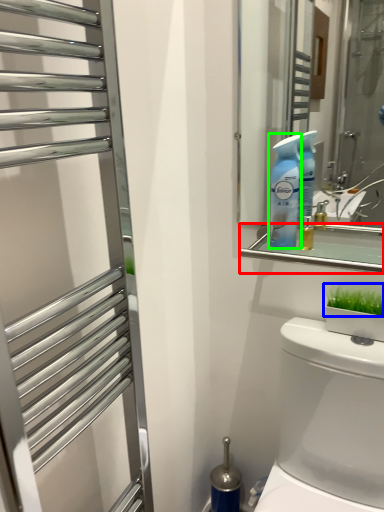
Question: Which object is positioned farthest from balustrade (highlighted by a red box)? Select from plant (highlighted by a blue box) and cleaning product (highlighted by a green box).

Choices:
 (A) plant
 (B) cleaning product

Answer: (A)